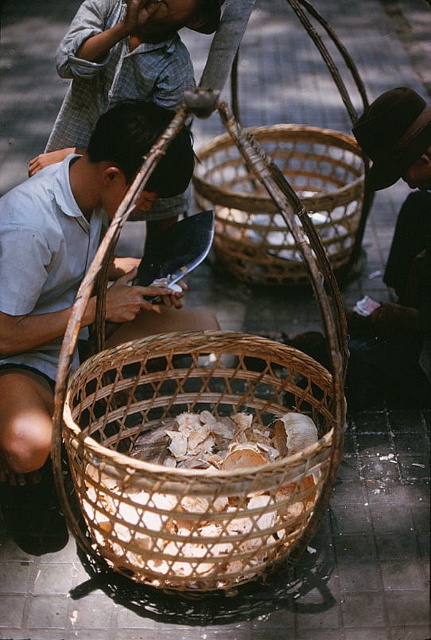
Question: Which object is closer to the camera taking this photo?

Choices:
 (A) woven bamboo basket at center
 (B) matte wicker basket at center
 (C) light blue shirt at lower left

Answer: (B)

Question: Is woven bamboo basket at center bigger than light blue shirt at lower left?

Choices:
 (A) no
 (B) yes

Answer: (B)

Question: Can you confirm if white textured shells at center is positioned to the left of light blue shirt at lower left?

Choices:
 (A) no
 (B) yes

Answer: (A)

Question: Is matte wicker basket at center wider than woven bamboo basket at center?

Choices:
 (A) yes
 (B) no

Answer: (B)

Question: Estimate the real-world distances between objects in this image. Which object is farther from the dark brown hat at upper right?

Choices:
 (A) light blue shirt at lower left
 (B) white textured shells at center
 (C) woven bamboo basket at center
 (D) matte wicker basket at center

Answer: (A)

Question: Which point appears closest to the camera in this image?

Choices:
 (A) (225, 228)
 (B) (406, 333)
 (C) (40, 372)

Answer: (C)